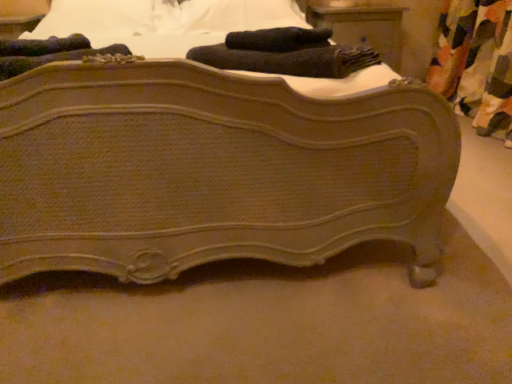
Question: In terms of size, does black soft towel at upper center appear bigger or smaller than matte brown wood nightstand at upper center?

Choices:
 (A) small
 (B) big

Answer: (A)

Question: From the image's perspective, is black soft towel at upper center above or below matte brown wood nightstand at upper center?

Choices:
 (A) below
 (B) above

Answer: (A)

Question: Based on their relative distances, which object is nearer to the multicolored fabric curtain at right?

Choices:
 (A) black soft towel at upper center
 (B) matte brown wooden bed at center
 (C) matte brown wood nightstand at upper center

Answer: (C)

Question: Estimate the real-world distances between objects in this image. Which object is farther from the multicolored fabric curtain at right?

Choices:
 (A) matte brown wood nightstand at upper center
 (B) matte brown wooden bed at center
 (C) black soft towel at upper center

Answer: (B)